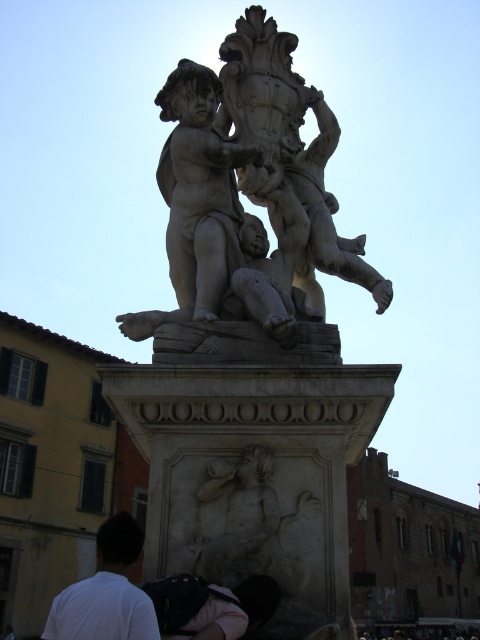
Question: Can you confirm if white marble sculpture at upper center is positioned below white matte shirt at lower left?

Choices:
 (A) no
 (B) yes

Answer: (A)

Question: Which object is farther from the camera taking this photo?

Choices:
 (A) white marble sculpture at upper center
 (B) white marble cherub at center

Answer: (B)

Question: Is white marble sculpture at upper center wider than white marble cherub at center?

Choices:
 (A) yes
 (B) no

Answer: (A)

Question: Estimate the real-world distances between objects in this image. Which object is farther from the white matte shirt at lower left?

Choices:
 (A) white marble sculpture at upper center
 (B) white marble cherub at center

Answer: (B)

Question: Does white marble sculpture at upper center appear on the left side of white matte shirt at lower left?

Choices:
 (A) yes
 (B) no

Answer: (B)

Question: Which point is farther to the camera?

Choices:
 (A) (164, 115)
 (B) (136, 547)
 (C) (180, 134)

Answer: (A)